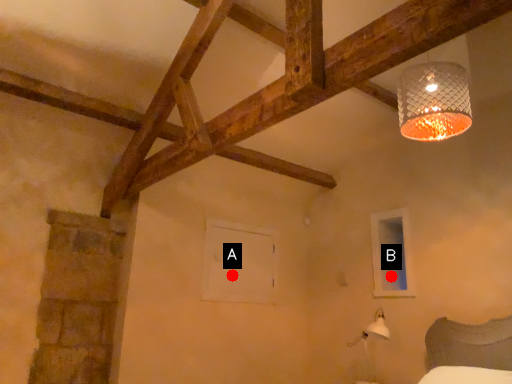
Question: Two points are circled on the image, labeled by A and B beside each circle. Which point appears farthest from the camera in this image?

Choices:
 (A) A is further
 (B) B is further

Answer: (A)